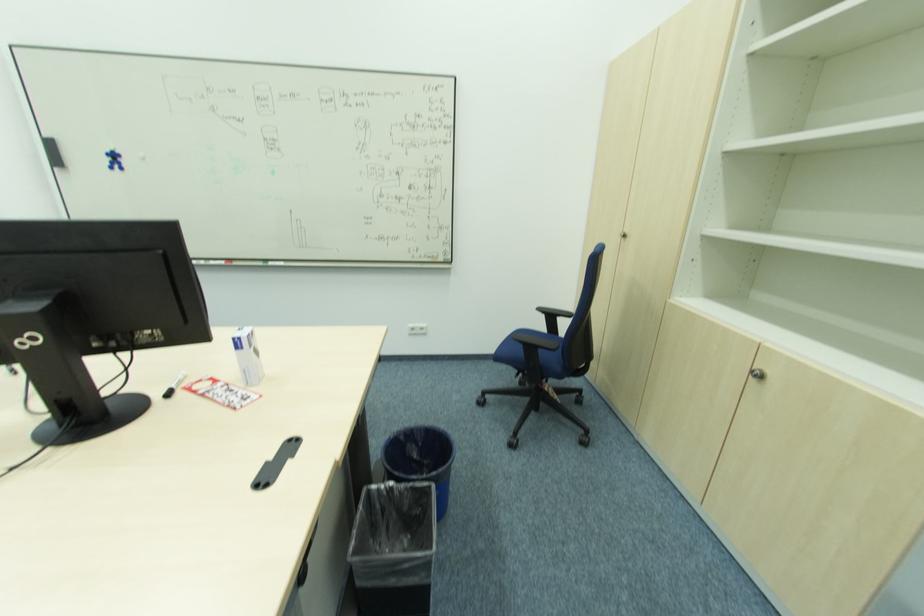
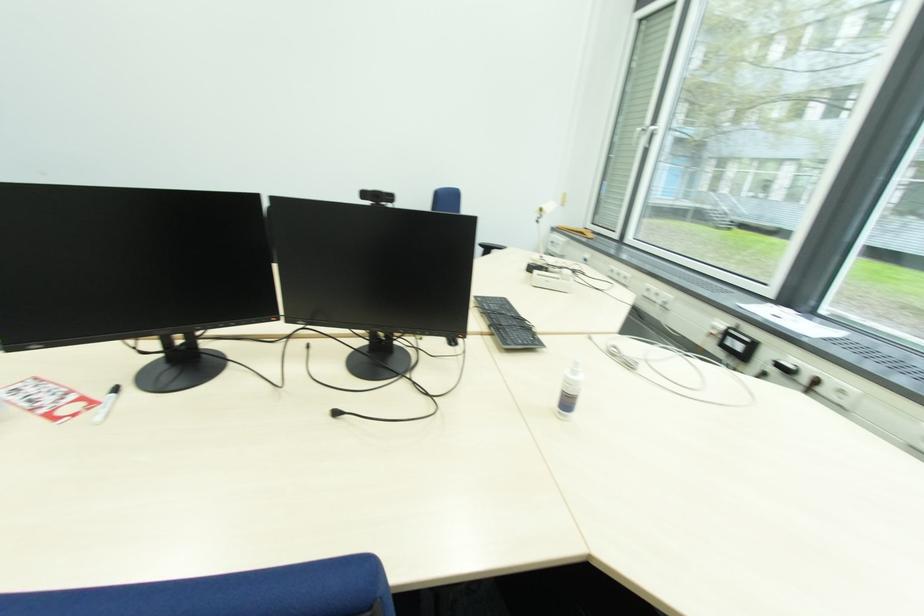
Where in the second image is the point corresponding to [175,397] from the first image?

(118, 392)